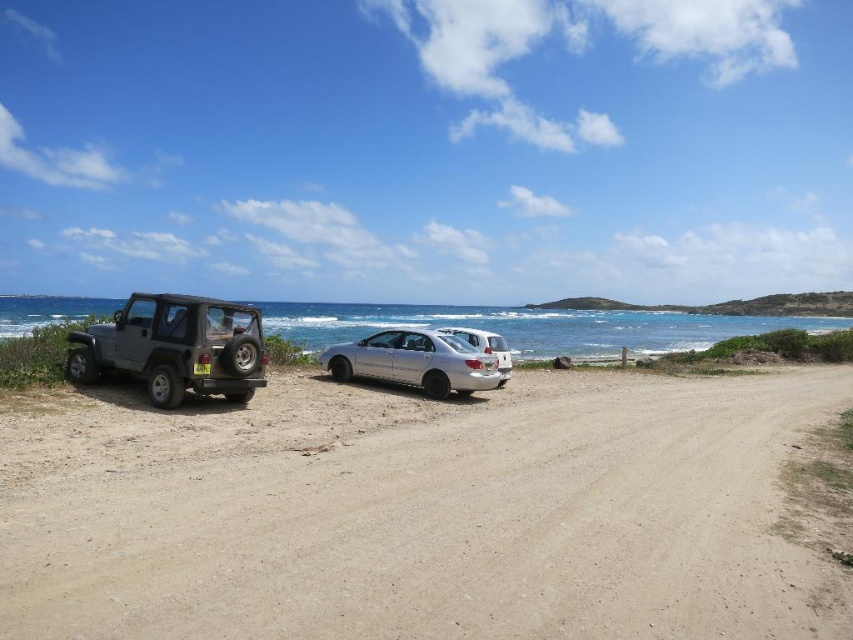
Question: From the image, what is the correct spatial relationship of matte black jeep at left in relation to satin silver sedan at center?

Choices:
 (A) left
 (B) right

Answer: (A)

Question: Is dirt track at center bigger than silver metallic sedan at center?

Choices:
 (A) yes
 (B) no

Answer: (A)

Question: Which point is farther from the camera taking this photo?

Choices:
 (A) (705, 568)
 (B) (187, 300)
 (C) (419, 356)

Answer: (C)

Question: Does dirt track at center have a smaller size compared to matte black jeep at left?

Choices:
 (A) no
 (B) yes

Answer: (A)

Question: Which point is closer to the camera?

Choices:
 (A) (370, 344)
 (B) (334, 484)
 (C) (186, 378)

Answer: (B)

Question: Estimate the real-world distances between objects in this image. Which object is farther from the dirt track at center?

Choices:
 (A) satin silver sedan at center
 (B) matte black jeep at left
 (C) silver metallic sedan at center

Answer: (A)